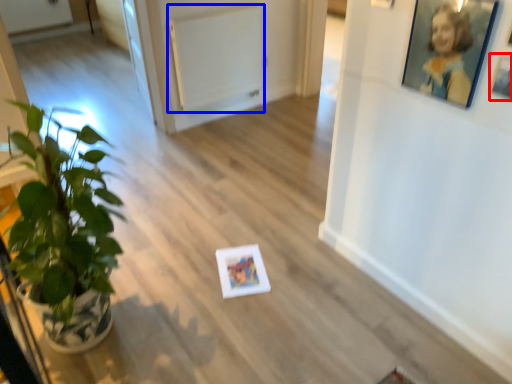
Question: Which of the following is the farthest to the observer, picture frame (highlighted by a red box) or radiator (highlighted by a blue box)?

Choices:
 (A) picture frame
 (B) radiator

Answer: (B)